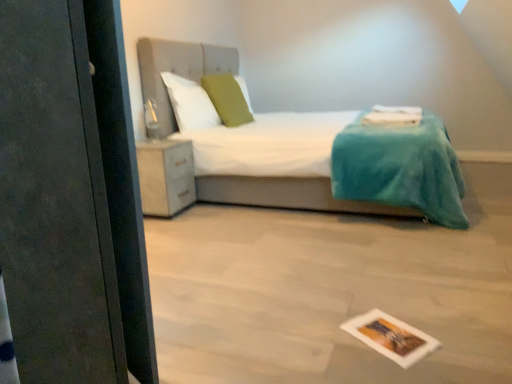
This screenshot has width=512, height=384. Identify the location of unoccupied area in front of printed paper postcard at lower center. (406, 369).